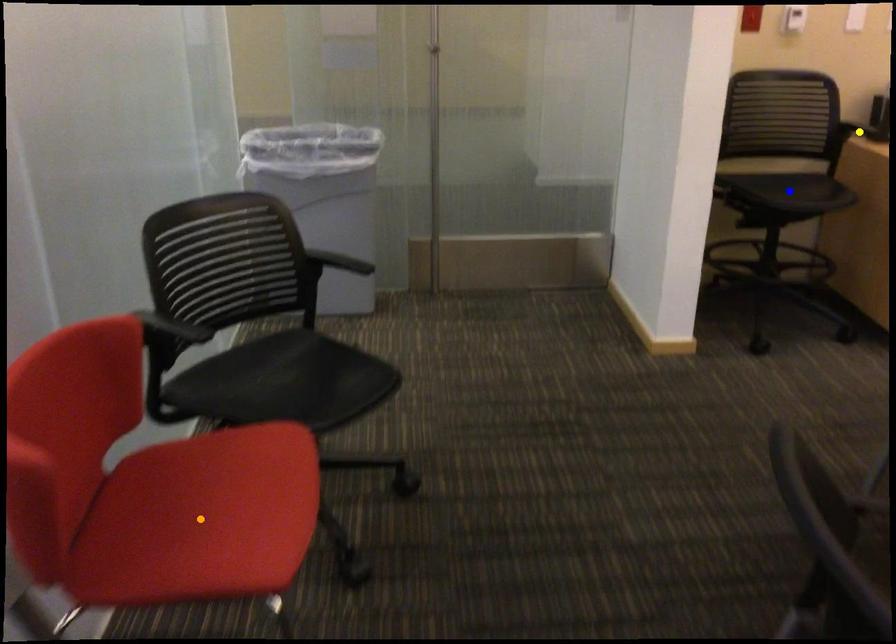
Order these from farthest to nearest:
orange point
blue point
yellow point

1. yellow point
2. blue point
3. orange point